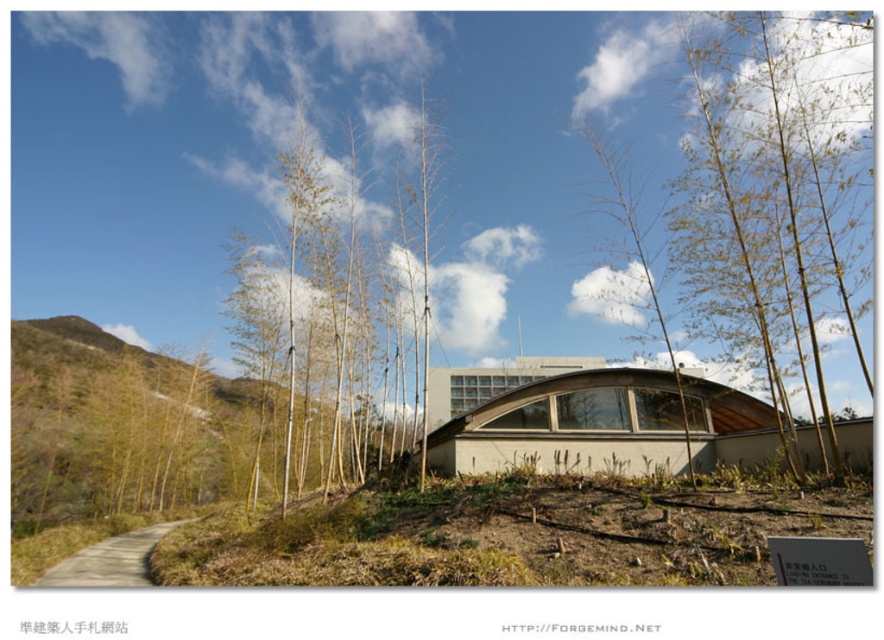
Question: Which point is closer to the camera taking this photo?

Choices:
 (A) pyautogui.click(x=73, y=554)
 (B) pyautogui.click(x=362, y=392)
 (C) pyautogui.click(x=675, y=369)

Answer: (C)

Question: Considering the real-world distances, which object is closest to the smooth white bamboo at center?

Choices:
 (A) yellow-green bamboo at center
 (B) brown dirt path at lower left

Answer: (B)

Question: Can you confirm if brown dirt path at lower left is bigger than brown wood tree at center?

Choices:
 (A) no
 (B) yes

Answer: (A)

Question: Which object is positioned farthest from the smooth white bamboo at center?

Choices:
 (A) yellow-green bamboo at center
 (B) brown dirt path at lower left
 (C) brown wood tree at center

Answer: (A)

Question: Is yellow-green bamboo at center below brown dirt path at lower left?

Choices:
 (A) no
 (B) yes

Answer: (A)

Question: Is brown dirt path at lower left wider than brown wood tree at center?

Choices:
 (A) yes
 (B) no

Answer: (A)